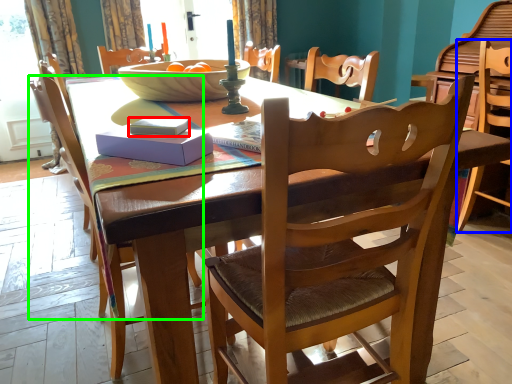
Question: Which object is the closest to the book (highlighted by a red box)? Choose among these: chair (highlighted by a blue box) or chair (highlighted by a green box).

Choices:
 (A) chair
 (B) chair

Answer: (B)